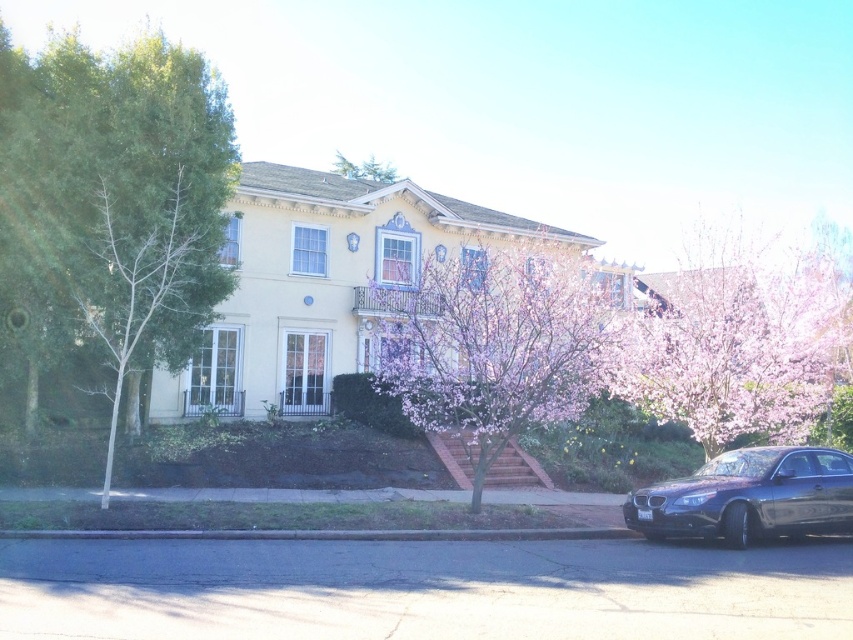
Question: Can you confirm if green leafy tree at left is thinner than pink blossoming tree at right?

Choices:
 (A) yes
 (B) no

Answer: (A)

Question: Which point is farther to the camera?

Choices:
 (A) green matte tree at upper center
 (B) pink blossoming tree at center
 (C) green leafy tree at left

Answer: (A)

Question: Which point is closer to the camera taking this photo?

Choices:
 (A) (582, 534)
 (B) (357, 176)
 (C) (637, 516)
 (D) (384, 330)

Answer: (C)

Question: Does pink blossoming tree at right have a larger size compared to glossy black car at lower right?

Choices:
 (A) yes
 (B) no

Answer: (A)

Question: Does pink blossoming tree at center appear under glossy black car at lower right?

Choices:
 (A) no
 (B) yes

Answer: (A)

Question: Which object appears farthest from the camera in this image?

Choices:
 (A) green leafy tree at left
 (B) pink blossoming tree at right

Answer: (A)